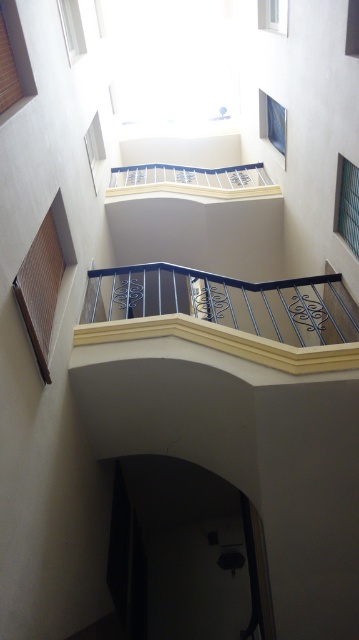
Which of these two, metallic wrought iron balcony at center or clear glass window at upper center, stands taller?

clear glass window at upper center is taller.

Between metallic wrought iron balcony at center and clear glass window at upper center, which one is positioned lower?

metallic wrought iron balcony at center is lower down.

This screenshot has height=640, width=359. Identify the location of metallic wrought iron balcony at center. (226, 316).

In order to click on metallic wrought iron balcony at center in this screenshot , I will do `click(226, 316)`.

Can you confirm if metallic wrought iron balcony at center is positioned below clear glass window at upper right?

Yes.

Who is more distant from viewer, (174, 284) or (350, 220)?

The point (174, 284) is more distant.

Locate an element on the screen. The height and width of the screenshot is (640, 359). metallic wrought iron balcony at center is located at coordinates (226, 316).

Is white metal balcony at upper center shorter than clear glass window at upper center?

Yes.

Which is above, white metal balcony at upper center or clear glass window at upper center?

clear glass window at upper center is above.

The width and height of the screenshot is (359, 640). What are the coordinates of `white metal balcony at upper center` in the screenshot? It's located at (192, 180).